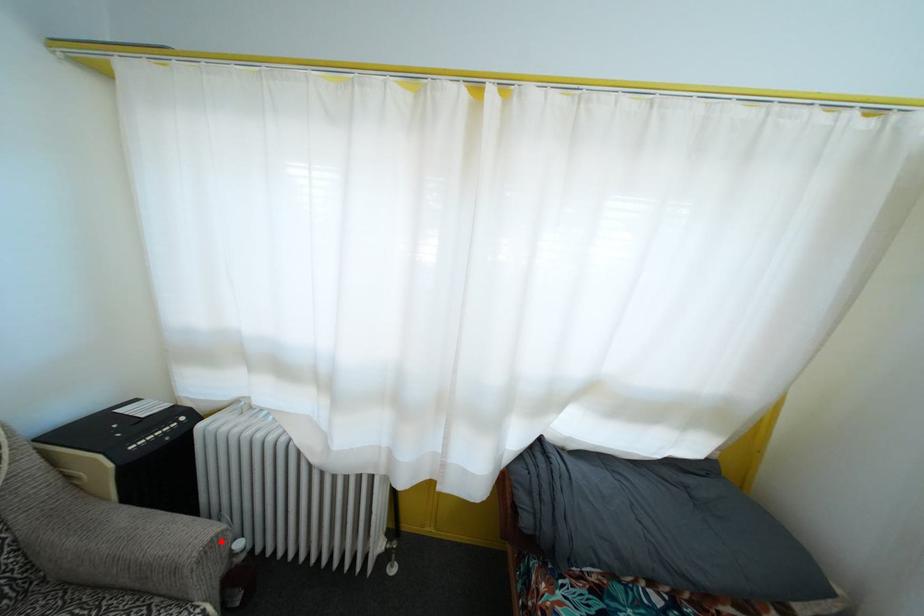
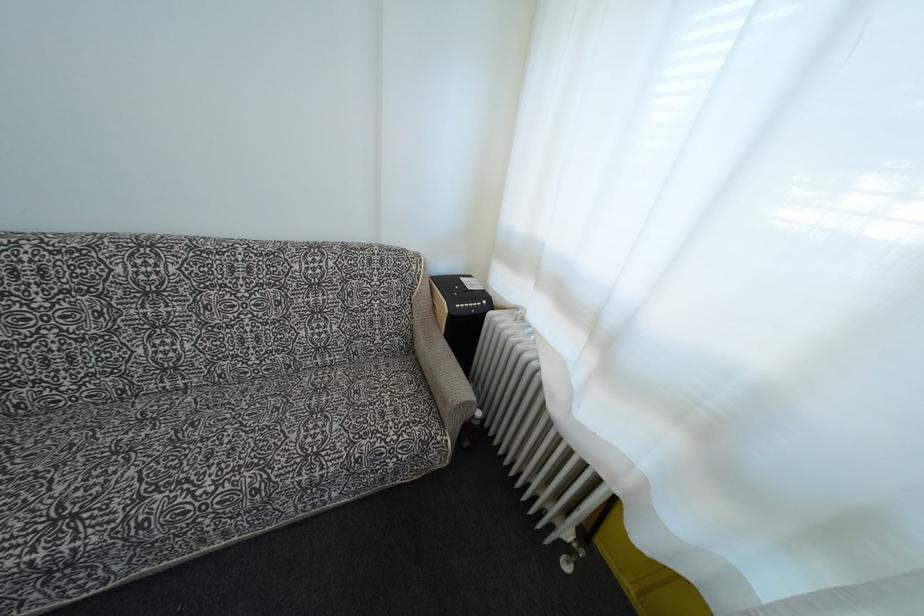
Where in the second image is the point corresponding to the highlighted location from the first image?

(472, 408)